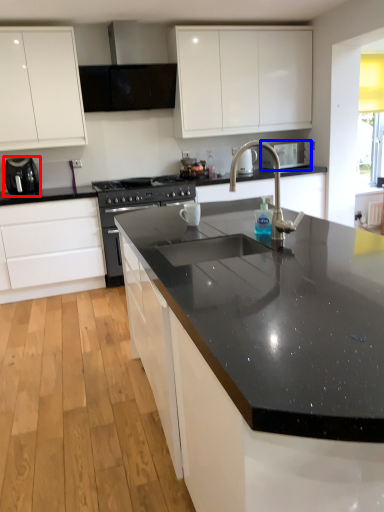
Question: Which object appears farthest to the camera in this image, appliance (highlighted by a red box) or appliance (highlighted by a blue box)?

Choices:
 (A) appliance
 (B) appliance

Answer: (B)